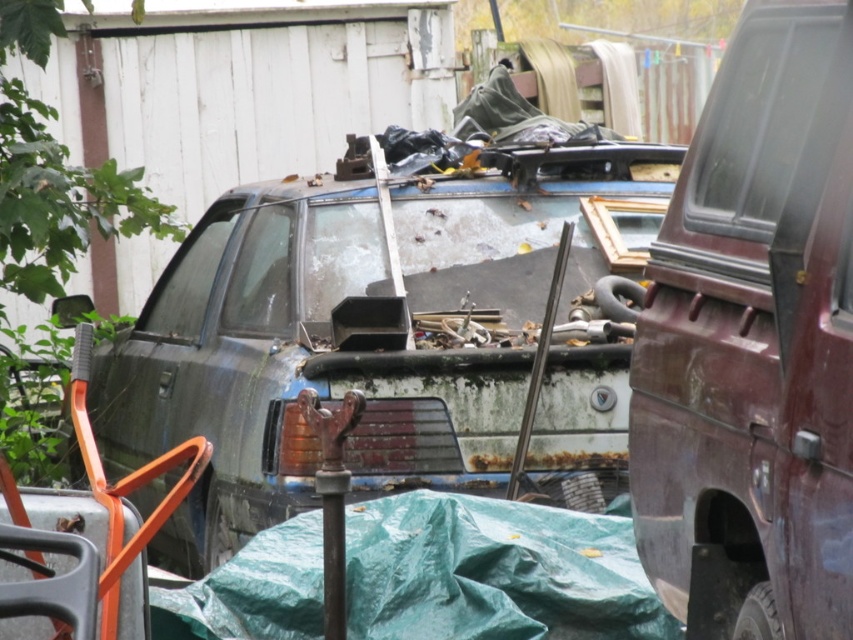
Question: Is rusty metal car at center below rusty metal pickup at right?

Choices:
 (A) no
 (B) yes

Answer: (A)

Question: Among these points, which one is nearest to the camera?

Choices:
 (A) (428, 209)
 (B) (724, 385)

Answer: (B)

Question: Which point is closer to the camera?

Choices:
 (A) rusty metal pickup at right
 (B) rusty metal car at center

Answer: (A)

Question: Is the position of rusty metal car at center less distant than that of rusty metal pickup at right?

Choices:
 (A) yes
 (B) no

Answer: (B)

Question: Can you confirm if rusty metal car at center is thinner than rusty metal pickup at right?

Choices:
 (A) yes
 (B) no

Answer: (B)